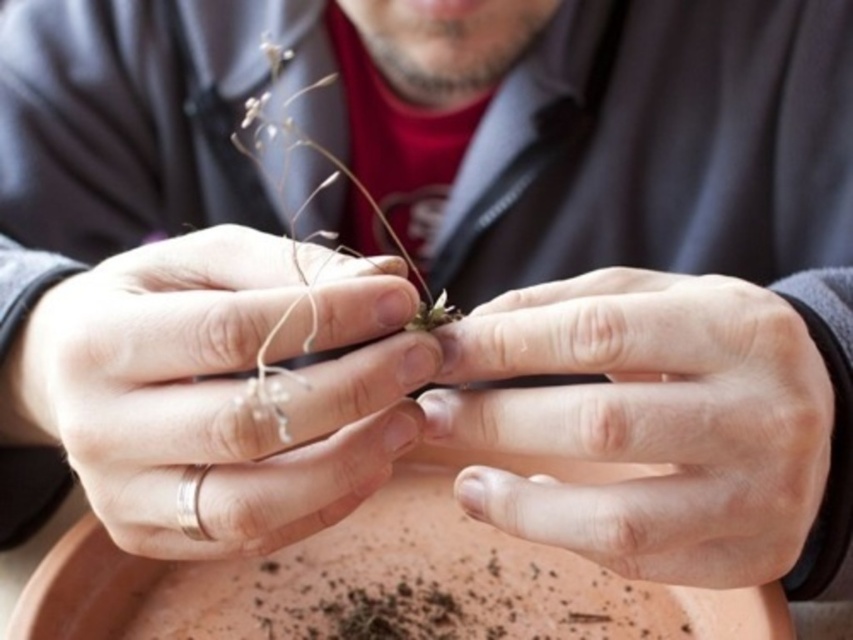
In the scene shown: You are a jeweler examining the hands in the image. You need to place a new ring on the smooth skin hand at center. According to the image, where should you place the new ring relative to the existing silver metallic ring at center?

The silver metallic ring at center is on the left side of the smooth skin hand at center, so the new ring should be placed on the right side of the silver metallic ring at center to avoid overlapping.

You are a jeweler examining the image of hands holding a plant. You notice a point marked at coordinate [202,397]. What object is located at that point?

The point at coordinate [202,397] indicates a silver metallic ring at center.

You are a jeweler examining the silver metallic ring at center while the person is holding a stem. Based on its position, can you determine if the ring is on the person hand or the stem?

The silver metallic ring at center is located at point (202, 397), which places it on the person hand rather than the stem.